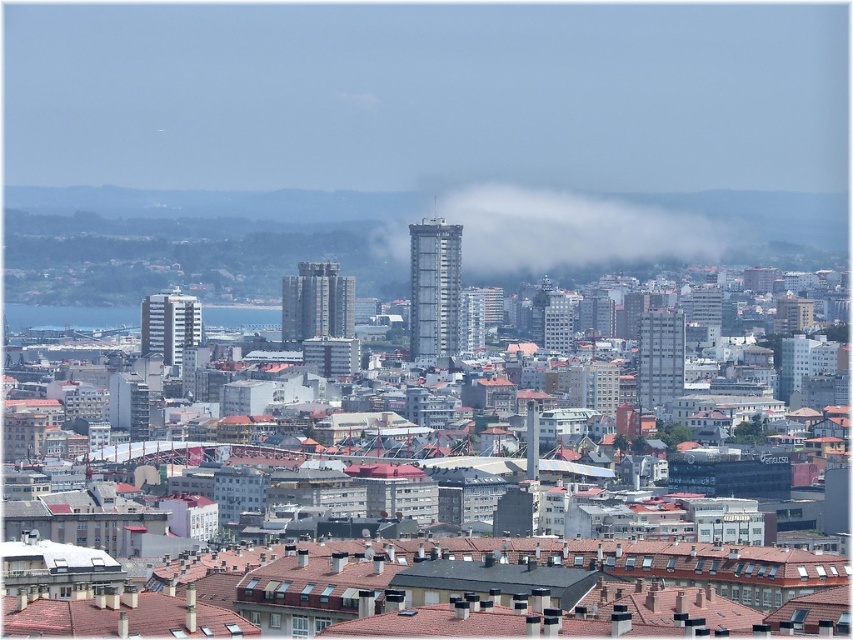
Can you confirm if white misty cloud at center is taller than blue water at center?

Correct, white misty cloud at center is much taller as blue water at center.

Does white misty cloud at center lie in front of blue water at center?

Yes, it is in front of blue water at center.

Image resolution: width=853 pixels, height=640 pixels. What do you see at coordinates (563, 227) in the screenshot?
I see `white misty cloud at center` at bounding box center [563, 227].

This screenshot has height=640, width=853. I want to click on white misty cloud at center, so click(563, 227).